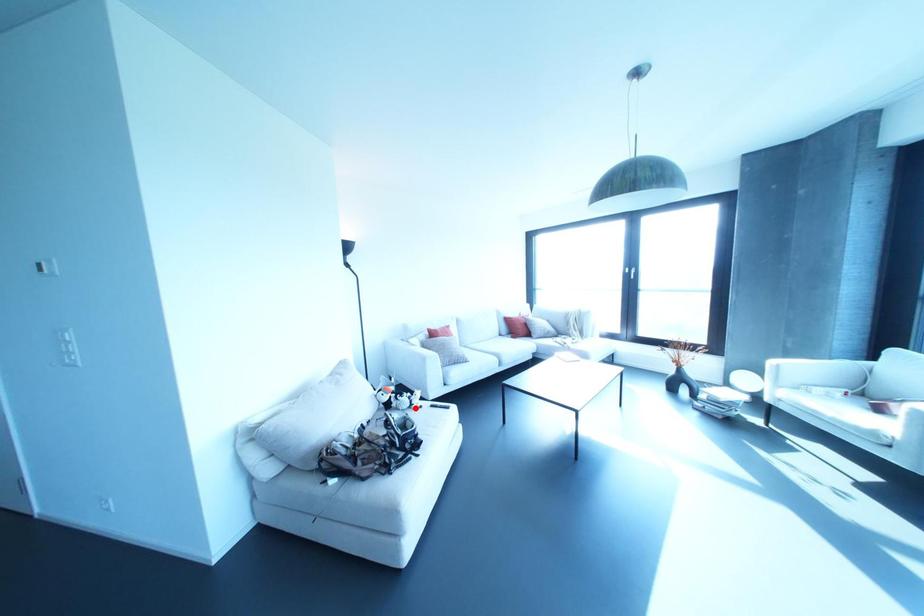
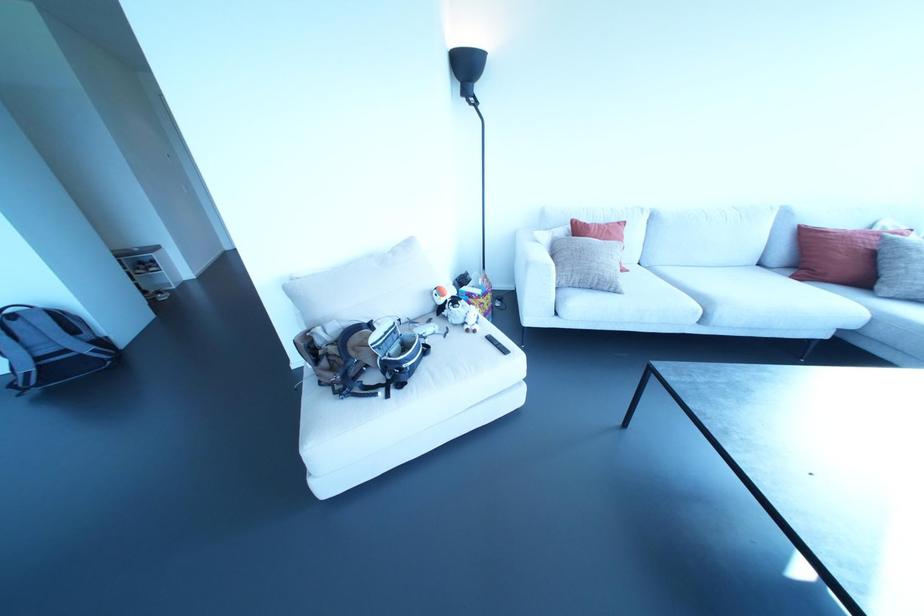
Where in the second image is the point corresponding to the highlighted location from the first image?

(467, 330)